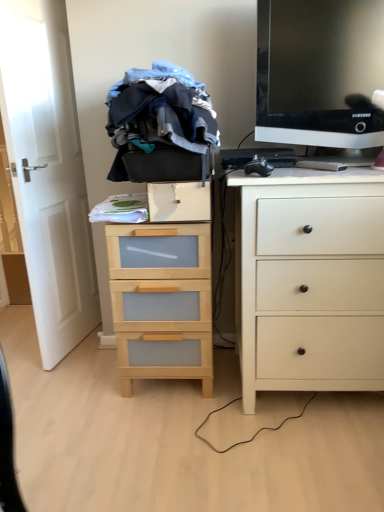
Question: Which direction should I rotate to face wooden chest of drawers at center, marked as the second chest of drawers in a right-to-left arrangement, — up or down?

Choices:
 (A) up
 (B) down

Answer: (B)

Question: Does wooden chest of drawers at center, the 1th chest of drawers from the left, have a greater width compared to wooden drawer at center?

Choices:
 (A) yes
 (B) no

Answer: (A)

Question: From a real-world perspective, is wooden chest of drawers at center, the 1th chest of drawers from the left, physically above wooden drawer at center?

Choices:
 (A) no
 (B) yes

Answer: (A)

Question: Considering the relative positions of wooden chest of drawers at center, the 1th chest of drawers from the left, and wooden drawer at center in the image provided, is wooden chest of drawers at center, the 1th chest of drawers from the left, to the left of wooden drawer at center from the viewer's perspective?

Choices:
 (A) yes
 (B) no

Answer: (A)

Question: Considering the relative sizes of wooden chest of drawers at center, the 1th chest of drawers from the left, and wooden drawer at center in the image provided, is wooden chest of drawers at center, the 1th chest of drawers from the left, thinner than wooden drawer at center?

Choices:
 (A) no
 (B) yes

Answer: (A)

Question: Is wooden drawer at center at the back of wooden chest of drawers at center, marked as the second chest of drawers in a right-to-left arrangement?

Choices:
 (A) yes
 (B) no

Answer: (B)

Question: From a real-world perspective, is wooden chest of drawers at center, marked as the second chest of drawers in a right-to-left arrangement, physically below wooden drawer at center?

Choices:
 (A) no
 (B) yes

Answer: (B)

Question: Considering the relative sizes of black plastic keyboard at center and blue cotton clothes at center in the image provided, is black plastic keyboard at center wider than blue cotton clothes at center?

Choices:
 (A) no
 (B) yes

Answer: (A)

Question: Is black plastic keyboard at center closer to the viewer compared to blue cotton clothes at center?

Choices:
 (A) yes
 (B) no

Answer: (B)

Question: Is black plastic keyboard at center at the left side of blue cotton clothes at center?

Choices:
 (A) no
 (B) yes

Answer: (A)

Question: Is black plastic keyboard at center taller than blue cotton clothes at center?

Choices:
 (A) no
 (B) yes

Answer: (A)

Question: Can you confirm if black plastic keyboard at center is thinner than blue cotton clothes at center?

Choices:
 (A) yes
 (B) no

Answer: (A)

Question: Is black plastic keyboard at center oriented towards blue cotton clothes at center?

Choices:
 (A) yes
 (B) no

Answer: (B)

Question: Is the position of wooden chest of drawers at center, the 1th chest of drawers from the left, more distant than that of black plastic keyboard at center?

Choices:
 (A) yes
 (B) no

Answer: (B)